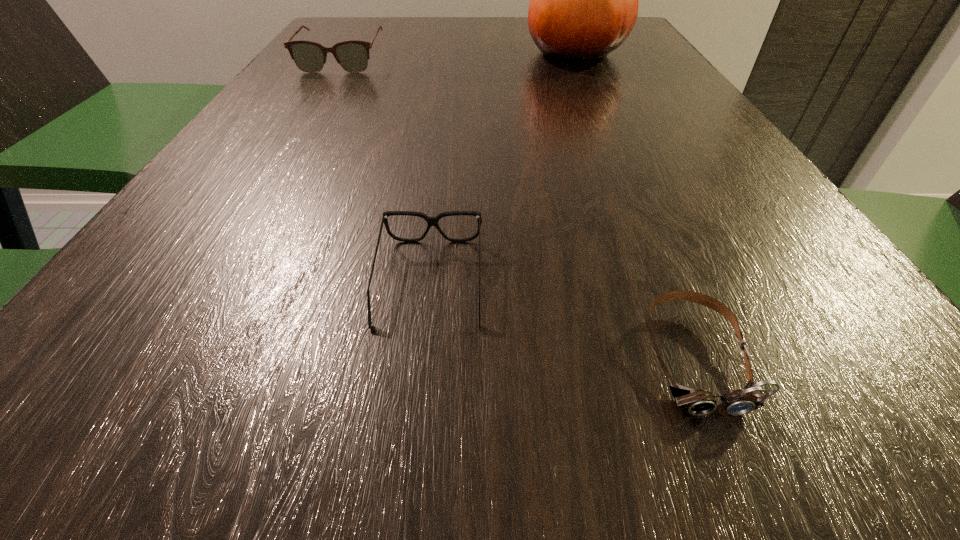
Locate an element on the screen. This screenshot has height=540, width=960. vacant space at the far left corner is located at coordinates (370, 27).

Identify the location of free space between the taller spectacles and the shorter spectacles. This screenshot has height=540, width=960. click(x=386, y=171).

You are a GUI agent. You are given a task and a screenshot of the screen. Output one action in this format:
    pyautogui.click(x=<x>, y=<y>)
    Task: Click on the free spot between the shorter spectacles and the goggles
    The image size is (960, 540).
    Given the screenshot: What is the action you would take?
    pyautogui.click(x=562, y=319)

Where is `empty space that is in between the third shortest object and the tallest object`? The height and width of the screenshot is (540, 960). empty space that is in between the third shortest object and the tallest object is located at coordinates pyautogui.click(x=459, y=56).

Where is `empty space between the third object from right to left and the goggles`? This screenshot has width=960, height=540. empty space between the third object from right to left and the goggles is located at coordinates (562, 319).

The height and width of the screenshot is (540, 960). I want to click on free space between the tallest object and the shorter spectacles, so click(x=503, y=167).

This screenshot has width=960, height=540. In order to click on free space between the tallest object and the right spectacles in this screenshot , I will do `click(503, 167)`.

I want to click on free spot between the right spectacles and the leftmost object, so click(386, 171).

You are a GUI agent. You are given a task and a screenshot of the screen. Output one action in this format:
    pyautogui.click(x=<x>, y=<y>)
    Task: Click on the free space between the nearer spectacles and the taller spectacles
    This screenshot has width=960, height=540.
    Given the screenshot: What is the action you would take?
    pyautogui.click(x=386, y=171)

This screenshot has height=540, width=960. Identify the location of vacant space that's between the goggles and the pumpkin. (635, 205).